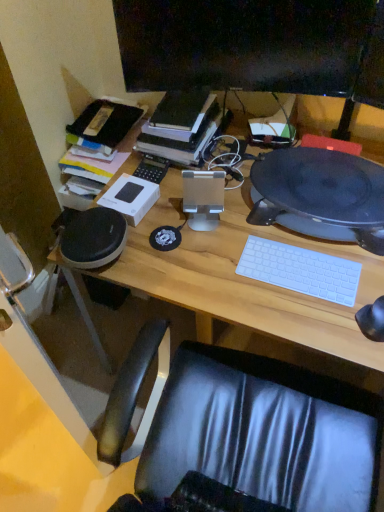
This screenshot has width=384, height=512. I want to click on empty space that is ontop of black matte speaker at right (from a real-world perspective), so click(x=321, y=178).